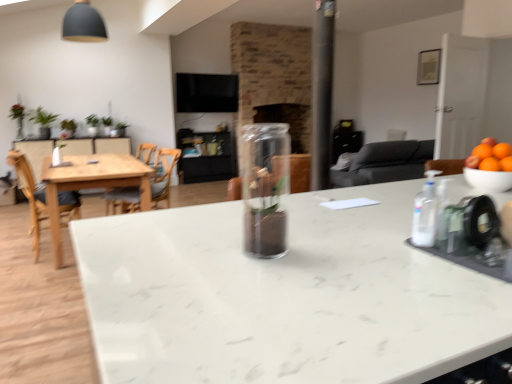
Question: Is light wood table at left wider or thinner than wooden chair at left, positioned as the 2th chair in left-to-right order?

Choices:
 (A) wide
 (B) thin

Answer: (A)

Question: Is light wood table at left inside or outside of wooden chair at left, the first chair positioned from the right?

Choices:
 (A) outside
 (B) inside

Answer: (A)

Question: Estimate the real-world distances between objects in this image. Which object is farther from the light wood table at left?

Choices:
 (A) white glossy bowl at right
 (B) transparent glass vase at center
 (C) orange matte bowl at right
 (D) wooden chair at left, the first chair viewed from the left
 (E) transparent plastic bottle at right

Answer: (E)

Question: Which of these objects is positioned closest to the white marble countertop at center?

Choices:
 (A) transparent plastic bottle at right
 (B) orange matte bowl at right
 (C) white glossy bowl at right
 (D) wooden chair at left, the first chair positioned from the right
 (E) transparent glass vase at center

Answer: (E)